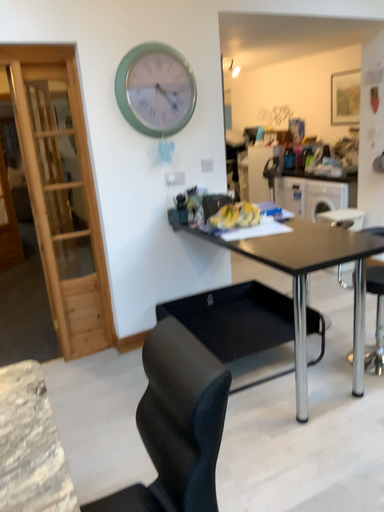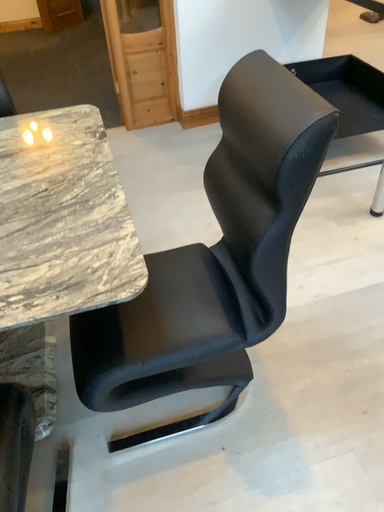
Question: Which way did the camera rotate in the video?

Choices:
 (A) rotated downward
 (B) rotated upward

Answer: (A)